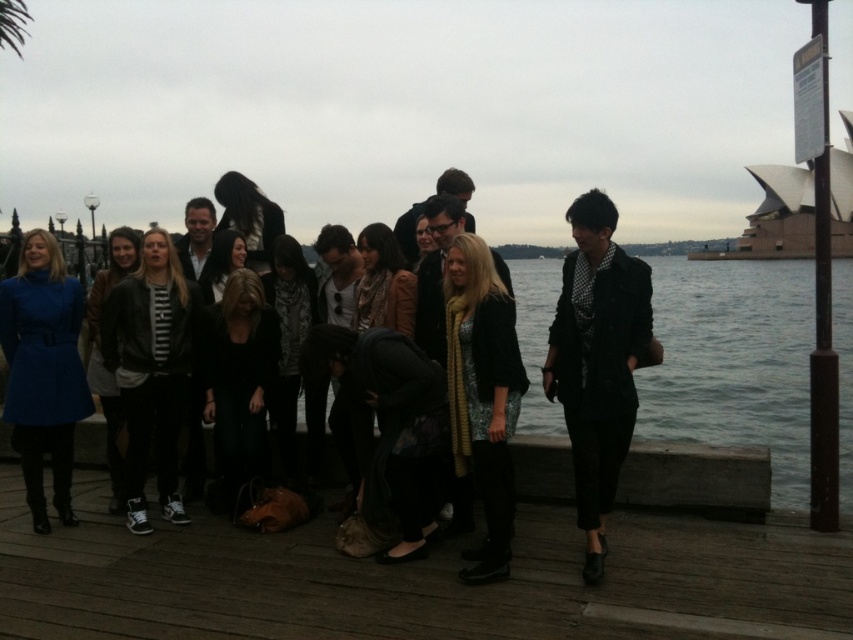
Question: Observing the image, what is the correct spatial positioning of matte black blazer at center in reference to matte blue coat at lower left?

Choices:
 (A) right
 (B) left

Answer: (A)

Question: Which of the following is the farthest from the observer?

Choices:
 (A) click(163, 429)
 (B) click(494, 531)
 (C) click(782, 458)

Answer: (C)

Question: Can you confirm if matte black blazer at center is bigger than shiny gold scarf at center?

Choices:
 (A) yes
 (B) no

Answer: (A)

Question: Based on their relative distances, which object is nearer to the shiny gold scarf at center?

Choices:
 (A) black leather jacket at center
 (B) matte blue coat at lower left
 (C) matte black blazer at center

Answer: (C)

Question: Which of these objects is positioned farthest from the matte blue coat at lower left?

Choices:
 (A) shiny gold scarf at center
 (B) matte black blazer at center
 (C) black leather jacket at center
 (D) wooden dock at center

Answer: (B)

Question: Is shiny gold scarf at center to the right of matte blue coat at lower left from the viewer's perspective?

Choices:
 (A) yes
 (B) no

Answer: (A)